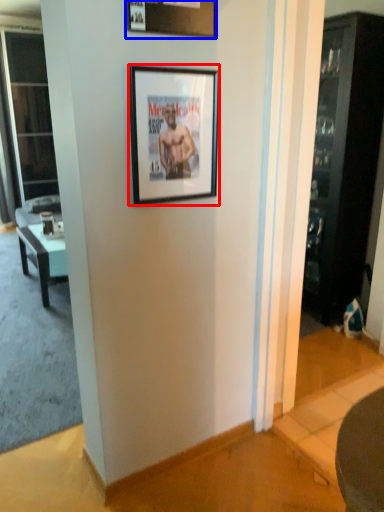
Question: Among these objects, which one is nearest to the camera, picture frame (highlighted by a red box) or picture frame (highlighted by a blue box)?

Choices:
 (A) picture frame
 (B) picture frame

Answer: (B)